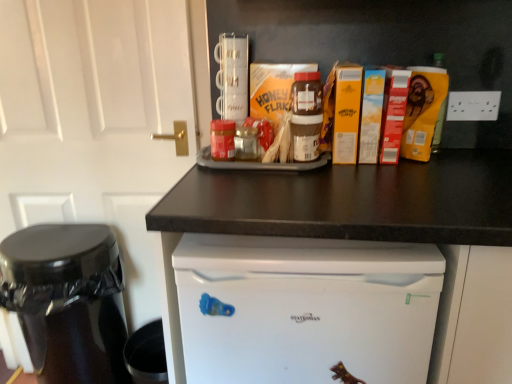
Question: From the image's perspective, is white plastic electric outlet at upper right located above or below shiny black coffee maker at left?

Choices:
 (A) below
 (B) above

Answer: (B)

Question: Considering the positions of white plastic electric outlet at upper right and shiny black coffee maker at left in the image, is white plastic electric outlet at upper right taller or shorter than shiny black coffee maker at left?

Choices:
 (A) tall
 (B) short

Answer: (B)

Question: Which of these objects is positioned closest to the white plastic electric outlet at upper right?

Choices:
 (A) shiny black coffee maker at left
 (B) dark brown laminate counter at center
 (C) white matte door at upper left

Answer: (B)

Question: Considering the real-world distances, which object is closest to the white matte door at upper left?

Choices:
 (A) dark brown laminate counter at center
 (B) white plastic electric outlet at upper right
 (C) shiny black coffee maker at left

Answer: (C)